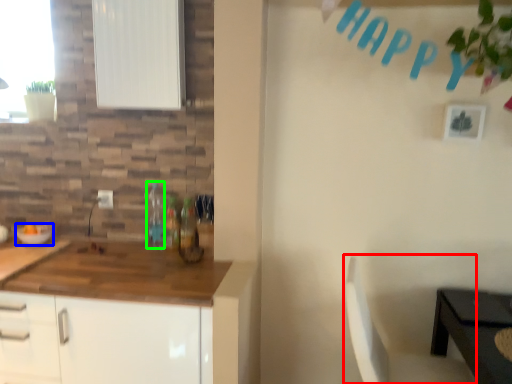
Question: Which object is positioned closest to chair (highlighted by a red box)? Select from bowl (highlighted by a blue box) and bottle (highlighted by a green box).

Choices:
 (A) bowl
 (B) bottle

Answer: (B)